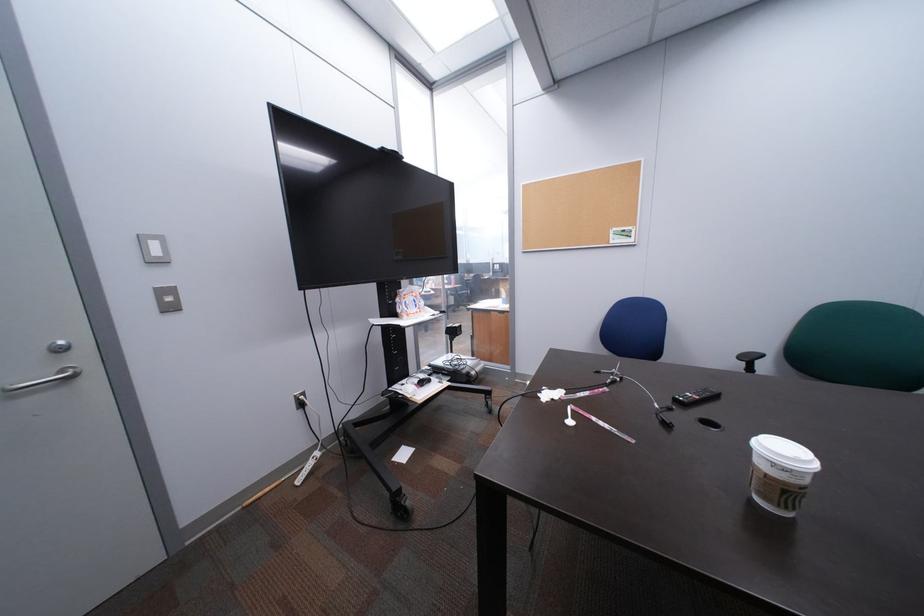
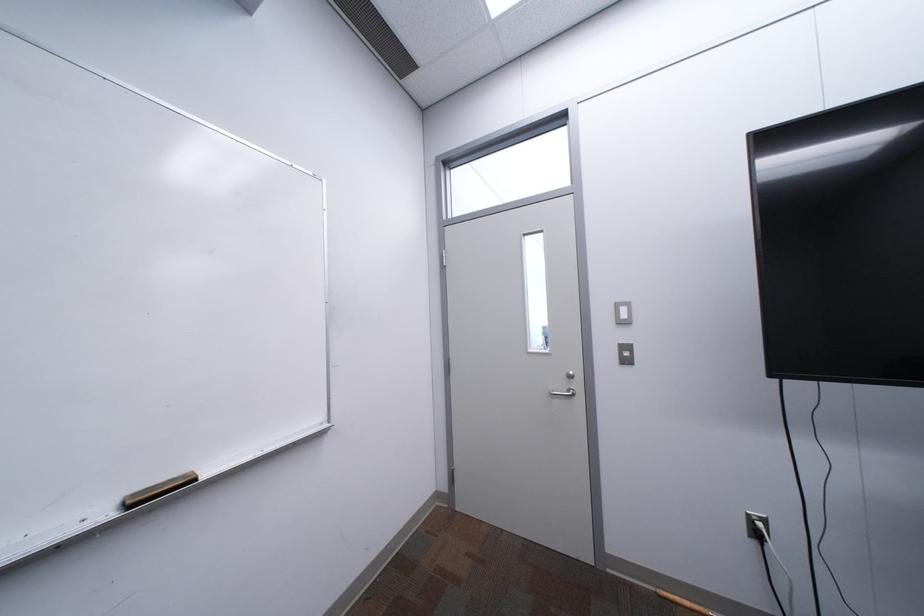
Question: The camera is either moving clockwise (left) or counter-clockwise (right) around the object. The first image is from the beginning of the video and the second image is from the end. Is the camera moving left or right when shooting the video?

Choices:
 (A) Left
 (B) Right

Answer: (B)